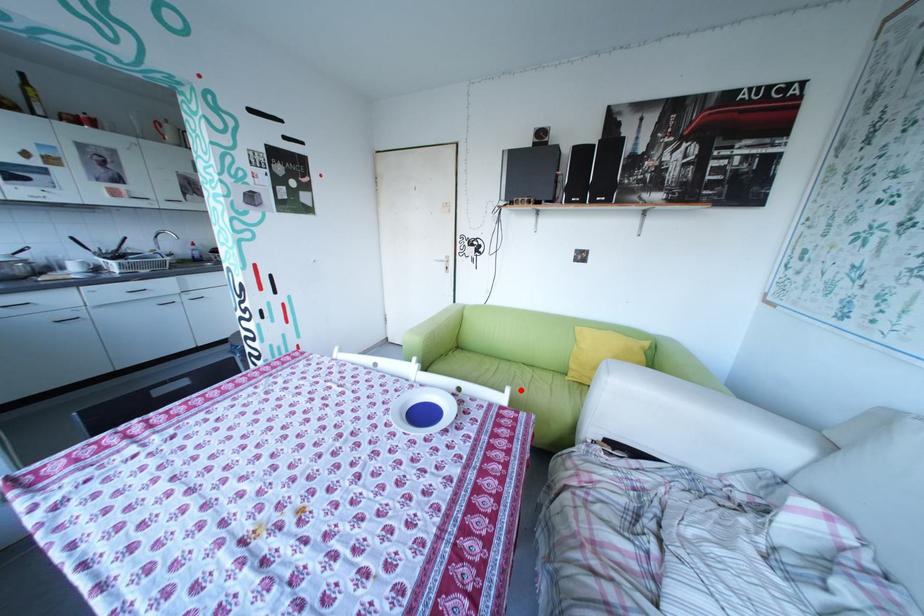
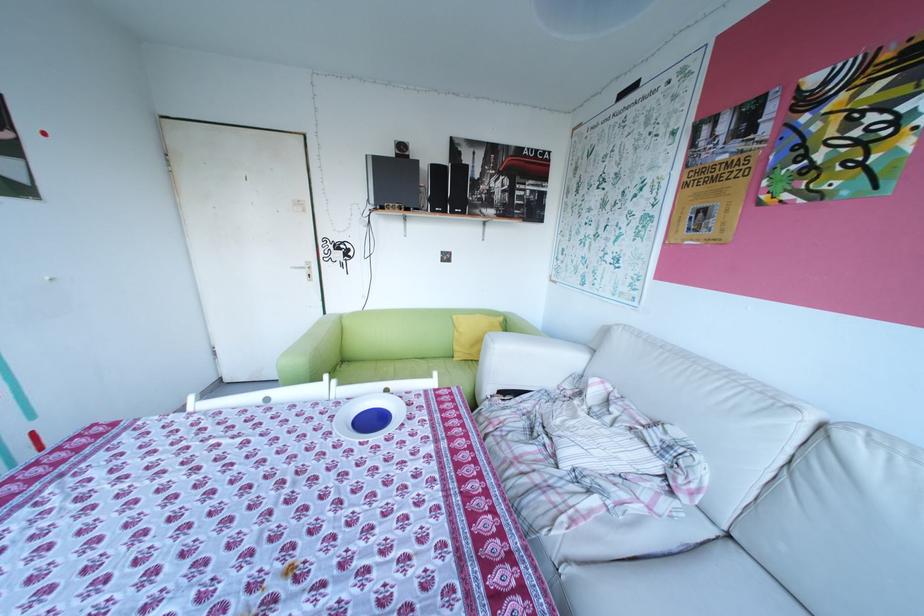
In the second image, find the point that corresponds to the highlighted location in the first image.

(448, 374)